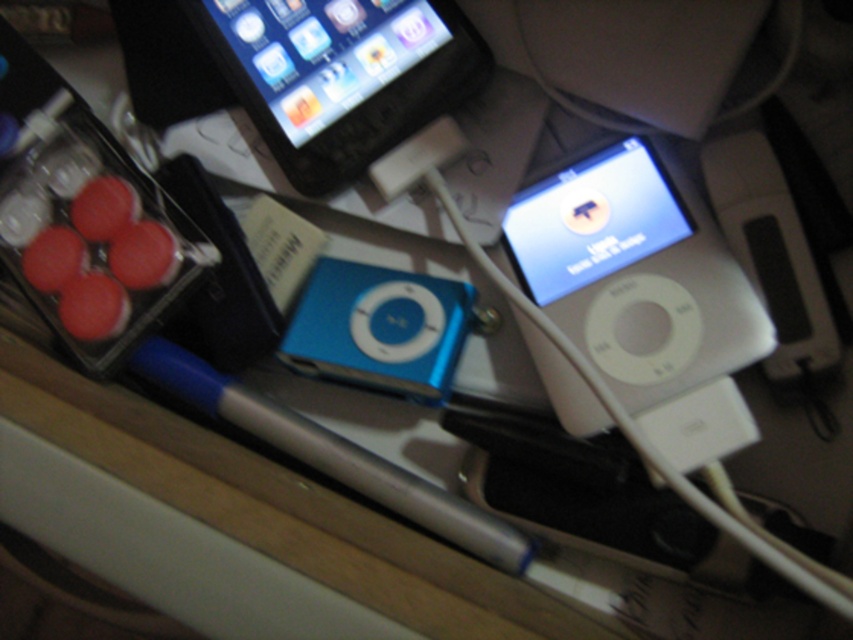
Who is taller, matte black phone at upper center or white plastic ipod at upper right?

white plastic ipod at upper right

Is point (283, 74) farther from viewer compared to point (709, 186)?

Yes, point (283, 74) is behind point (709, 186).

I want to click on matte black phone at upper center, so click(x=340, y=76).

Which is more to the right, white glossy ipod at upper right or white plastic ipod at upper right?

white plastic ipod at upper right

Which is in front, point (641, 180) or point (776, 230)?

Positioned in front is point (776, 230).

Is point (543, 284) more distant than point (795, 209)?

Yes.

Where is `white glossy ipod at upper right`? white glossy ipod at upper right is located at coordinates (636, 273).

Can you confirm if matte black phone at upper center is wider than blue plastic ipod at center?

Yes.

Between point (343, 74) and point (442, 362), which one is positioned in front?

Positioned in front is point (442, 362).

Between point (318, 58) and point (448, 292), which one is positioned in front?

Point (448, 292) is in front.

This screenshot has height=640, width=853. Find the location of `matte black phone at upper center`. matte black phone at upper center is located at coordinates (340, 76).